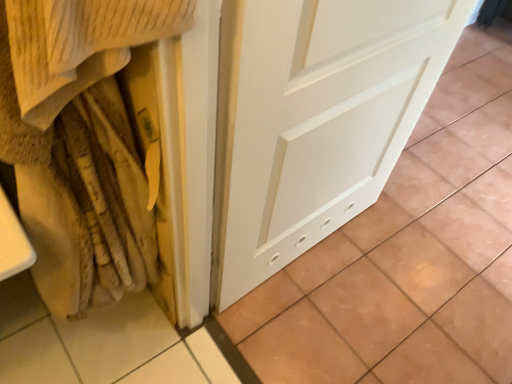
Question: Should I look upward or downward to see white matte door at center?

Choices:
 (A) up
 (B) down

Answer: (A)

Question: Is beige textured blanket at left shorter than white matte door at center?

Choices:
 (A) yes
 (B) no

Answer: (B)

Question: Is beige textured blanket at left bigger than white matte door at center?

Choices:
 (A) yes
 (B) no

Answer: (B)

Question: Is beige textured blanket at left positioned far away from white matte door at center?

Choices:
 (A) no
 (B) yes

Answer: (A)

Question: Could you tell me if beige textured blanket at left is turned towards white matte door at center?

Choices:
 (A) no
 (B) yes

Answer: (A)

Question: Can you confirm if beige textured blanket at left is positioned to the left of white matte door at center?

Choices:
 (A) no
 (B) yes

Answer: (B)

Question: Can you confirm if beige textured blanket at left is smaller than white matte door at center?

Choices:
 (A) no
 (B) yes

Answer: (B)

Question: Is white matte door at center at the left side of beige textured blanket at left?

Choices:
 (A) no
 (B) yes

Answer: (A)

Question: Is white matte door at center further to the viewer compared to beige textured blanket at left?

Choices:
 (A) no
 (B) yes

Answer: (B)

Question: Could you tell me if white matte door at center is facing beige textured blanket at left?

Choices:
 (A) no
 (B) yes

Answer: (A)

Question: From the image's perspective, does white matte door at center appear higher than beige textured blanket at left?

Choices:
 (A) no
 (B) yes

Answer: (B)

Question: Is white matte door at center located outside beige textured blanket at left?

Choices:
 (A) no
 (B) yes

Answer: (B)

Question: Can you confirm if white matte door at center is smaller than beige textured blanket at left?

Choices:
 (A) no
 (B) yes

Answer: (A)

Question: In the image, is white matte door at center positioned in front of or behind beige textured blanket at left?

Choices:
 (A) behind
 (B) front

Answer: (A)